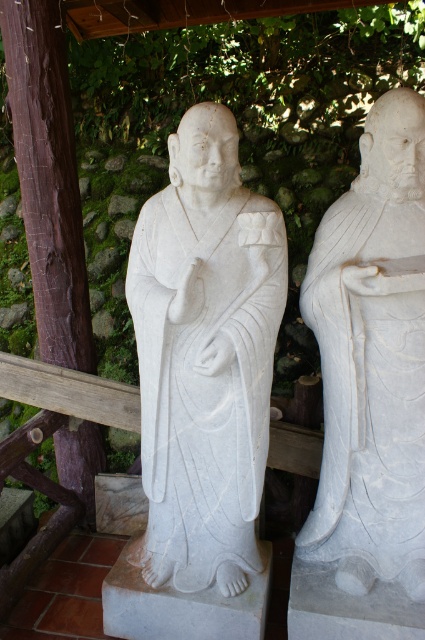
Between white marble statue at right and brown wood at left, which one has less height?

brown wood at left is shorter.

Who is positioned more to the left, white marble statue at right or brown wood at left?

From the viewer's perspective, brown wood at left appears more on the left side.

This screenshot has width=425, height=640. What are the coordinates of `white marble statue at right` in the screenshot? It's located at (371, 360).

The width and height of the screenshot is (425, 640). What are the coordinates of `white marble statue at right` in the screenshot? It's located at (371, 360).

Is point (187, 509) closer to camera compared to point (0, 19)?

Yes.

Which is above, white marble statue at center or brown wood at left?

brown wood at left is higher up.

Who is more forward, (255, 316) or (19, 134)?

Positioned in front is point (255, 316).

You are a GUI agent. You are given a task and a screenshot of the screen. Output one action in this format:
    pyautogui.click(x=<x>, y=<y>)
    Task: Click on the white marble statue at center
    The height and width of the screenshot is (640, 425).
    Given the screenshot: What is the action you would take?
    pyautogui.click(x=204, y=356)

Between white marble statue at center and white marble statue at right, which one is positioned higher?

Positioned higher is white marble statue at right.

Can you confirm if white marble statue at center is thinner than white marble statue at right?

No.

Between point (159, 225) and point (359, 579), which one is positioned behind?

Point (359, 579)

Find the location of a particular element. white marble statue at center is located at coordinates (204, 356).